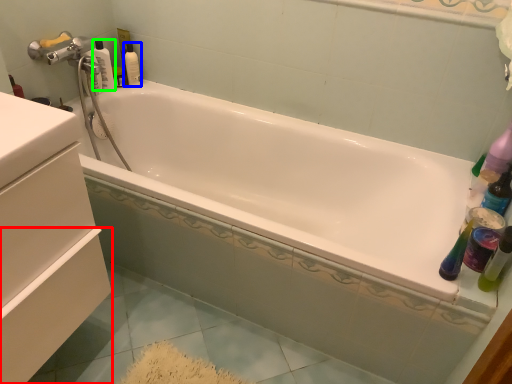
Question: Which object is positioned closest to drawer (highlighted by a red box)? Select from mouthwash (highlighted by a blue box) and bottle (highlighted by a green box).

Choices:
 (A) mouthwash
 (B) bottle

Answer: (B)